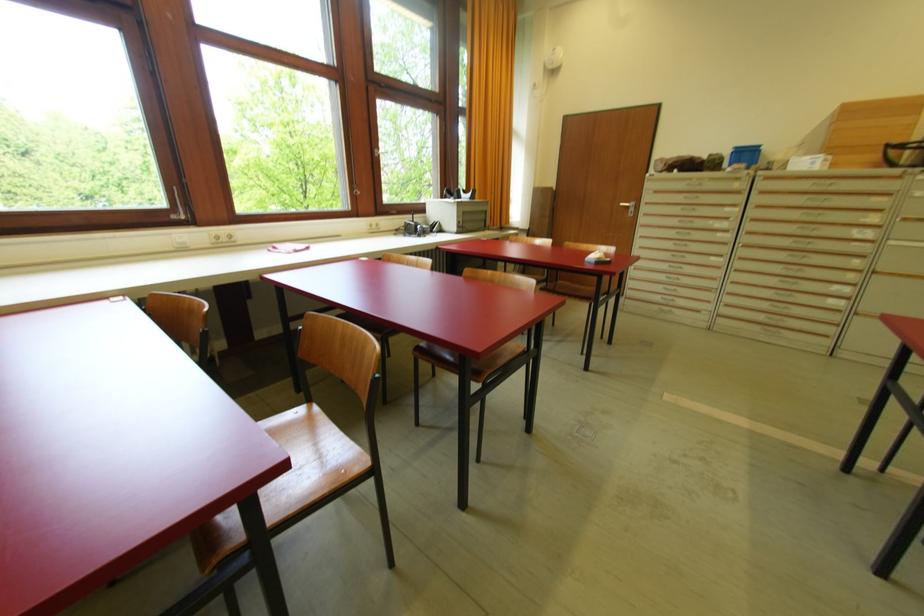
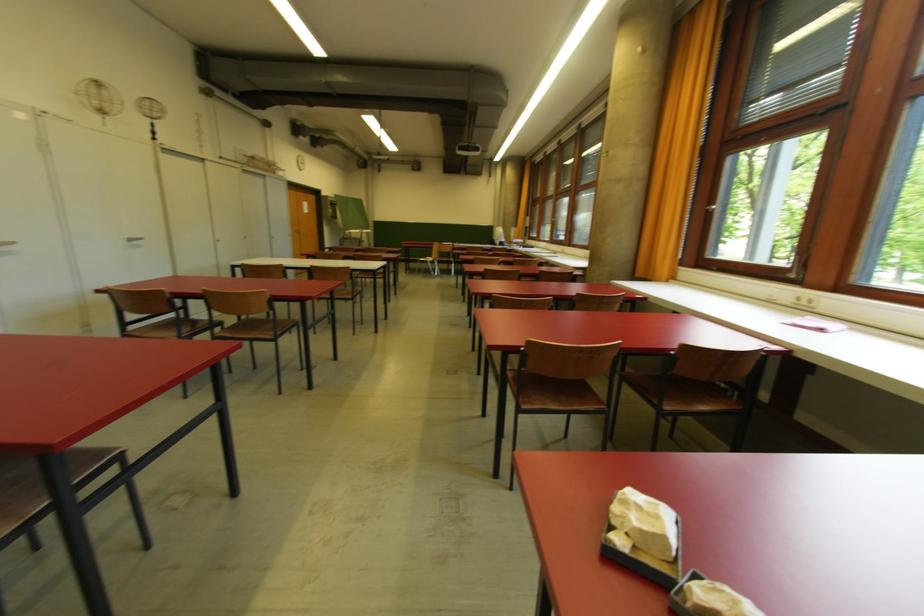
In the second image, find the point that corresponds to (x=310, y=249) in the first image.

(823, 331)